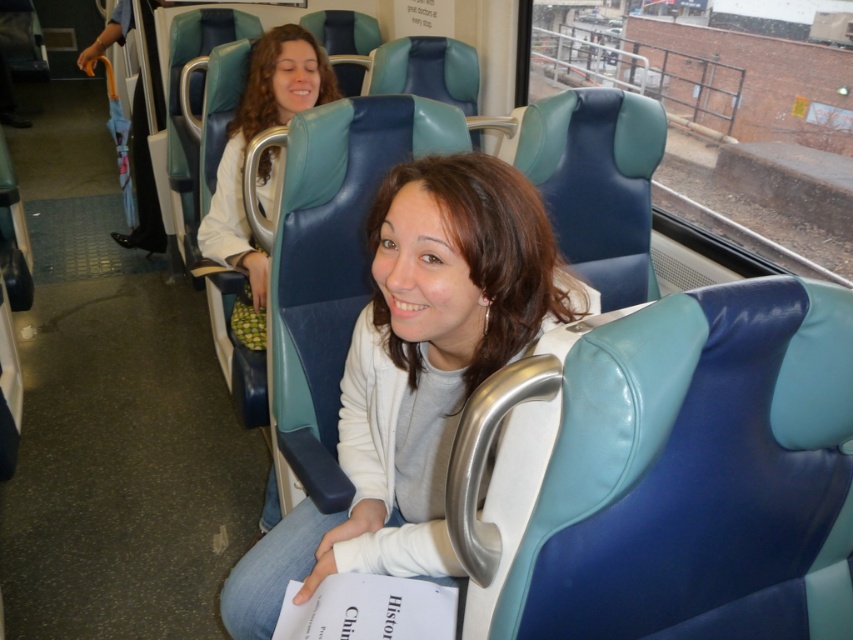
Does matte blue jacket at center have a greater height compared to matte white shirt at upper center?

In fact, matte blue jacket at center may be shorter than matte white shirt at upper center.

Is point (519, 218) positioned behind point (231, 120)?

No.

This screenshot has width=853, height=640. What are the coordinates of `matte blue jacket at center` in the screenshot? It's located at (416, 372).